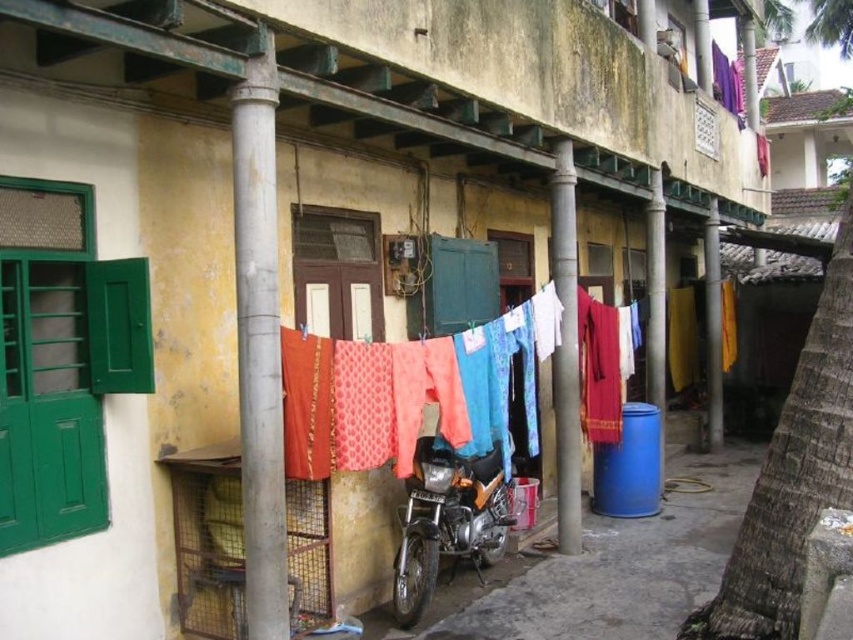
You are standing in front of the building and want to take a photo that includes both the point at coordinates [242,176] and the point at [567,536]. Which point should be placed closer to the front of the photo to ensure both are visible?

Since point [242,176] is closer to the camera than point [567,536], you should place the point at [242,176] closer to the front of the photo to ensure both are visible.

You are standing in front of the building and want to walk towards the gray concrete pillar at center and the smooth concrete pole at center. Which one should you approach first to reach the one closer to you?

You should approach the gray concrete pillar at center first because it is closer to you than the smooth concrete pole at center.